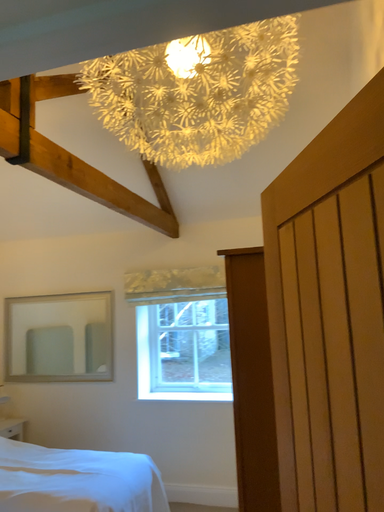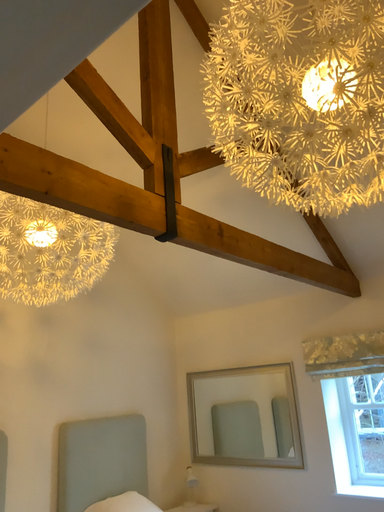
Question: Which way did the camera rotate in the video?

Choices:
 (A) rotated downward
 (B) rotated upward

Answer: (B)